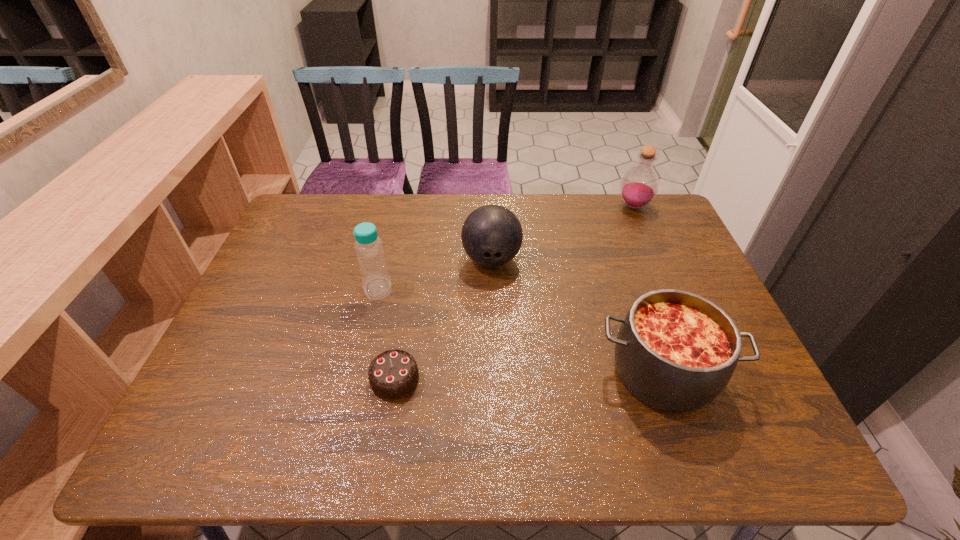
At what (x,y) coordinates should I click in order to perform the action: click on object that is the fourth closest to the bowling ball. Please return your answer as a coordinate pair (x, y). Looking at the image, I should click on (639, 186).

The height and width of the screenshot is (540, 960). What are the coordinates of `the second closest object relative to the chocolate cake` in the screenshot? It's located at (492, 235).

Image resolution: width=960 pixels, height=540 pixels. What are the coordinates of `vacant space that satisfies the following two spatial constraints: 1. on the grip area of the casserole; 2. on the right side of the third object from left to right` in the screenshot? It's located at (494, 373).

I want to click on free space that satisfies the following two spatial constraints: 1. on the back side of the farther bottle; 2. on the right side of the casserole, so click(x=605, y=206).

The image size is (960, 540). I want to click on free space that satisfies the following two spatial constraints: 1. on the back side of the farther bottle; 2. on the right side of the nearer bottle, so click(x=397, y=206).

Locate an element on the screen. The image size is (960, 540). free spot that satisfies the following two spatial constraints: 1. on the grip area of the casserole; 2. on the right side of the bowling ball is located at coordinates (494, 373).